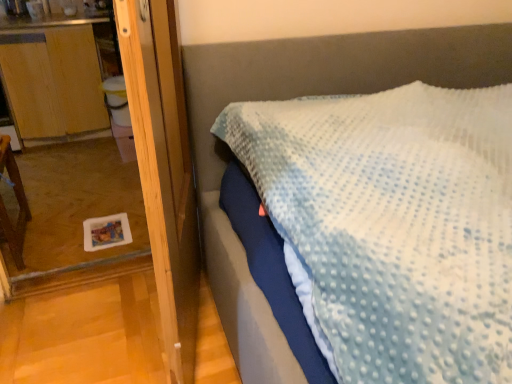
Question: Considering the positions of wooden dresser at left and brown wooden chair at left in the image, is wooden dresser at left taller or shorter than brown wooden chair at left?

Choices:
 (A) tall
 (B) short

Answer: (B)

Question: From a real-world perspective, is wooden dresser at left above or below brown wooden chair at left?

Choices:
 (A) below
 (B) above

Answer: (B)

Question: Which object is positioned closest to the wooden screen door at left?

Choices:
 (A) brown wooden chair at left
 (B) wooden dresser at left

Answer: (A)

Question: Estimate the real-world distances between objects in this image. Which object is farther from the wooden dresser at left?

Choices:
 (A) brown wooden chair at left
 (B) wooden screen door at left

Answer: (B)